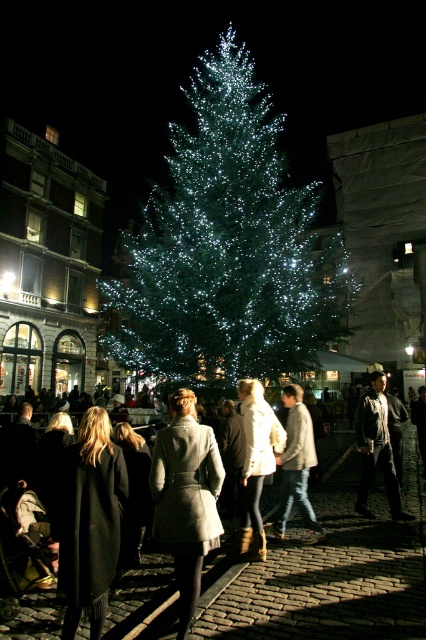
Which is above, black wool coat at center or leather jacket at center?

leather jacket at center is higher up.

Is black wool coat at center shorter than leather jacket at center?

In fact, black wool coat at center may be taller than leather jacket at center.

Locate an element on the screen. Image resolution: width=426 pixels, height=640 pixels. black wool coat at center is located at coordinates (89, 520).

Consider the image. How distant is gray wool coat at center from leather jacket at center?

34.35 feet

Is gray wool coat at center thinner than leather jacket at center?

No, gray wool coat at center is not thinner than leather jacket at center.

Image resolution: width=426 pixels, height=640 pixels. I want to click on gray wool coat at center, so click(328, 580).

Locate an element on the screen. Image resolution: width=426 pixels, height=640 pixels. gray wool coat at center is located at coordinates (328, 580).

Between white wool coat at center and leather jacket at center, which one is positioned lower?

white wool coat at center is lower down.

Does white wool coat at center have a lesser height compared to leather jacket at center?

No, white wool coat at center is not shorter than leather jacket at center.

Identify the location of white wool coat at center. This screenshot has height=640, width=426. (256, 460).